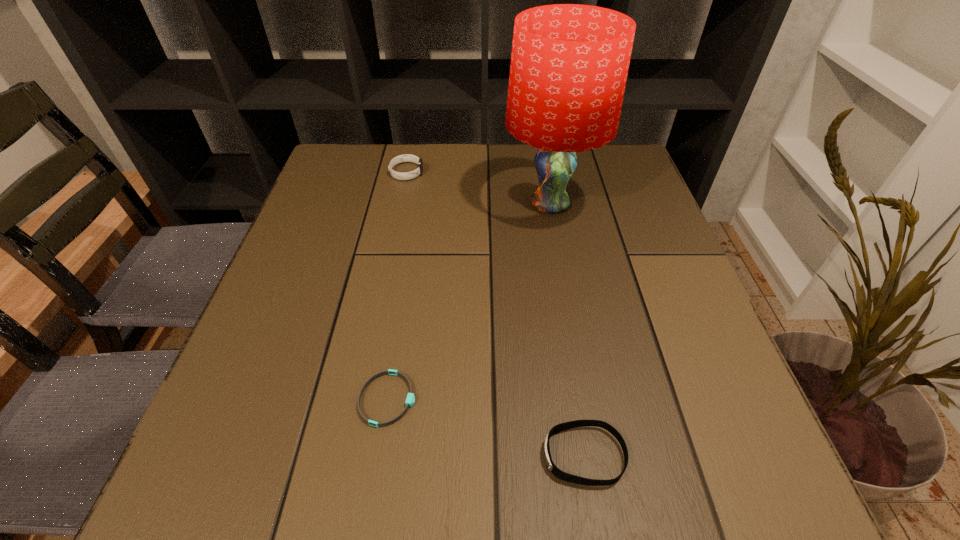
The image size is (960, 540). Identify the location of free space located on the display of the third tallest object. click(419, 456).

I want to click on free space located on the buckle of the shortest wristband, so click(x=542, y=399).

The height and width of the screenshot is (540, 960). Identify the location of lampshade present at the far edge. (569, 64).

Identify the location of wristband positioned at the far edge. (406, 157).

The width and height of the screenshot is (960, 540). Find the location of `object located in the near edge section of the desktop`. object located in the near edge section of the desktop is located at coordinates pos(564,476).

Identify the location of object that is positioned at the right edge. (569, 64).

The width and height of the screenshot is (960, 540). In order to click on object that is at the far right corner in this screenshot , I will do click(x=569, y=64).

Find the location of a particular element. The height and width of the screenshot is (540, 960). vacant area at the far edge is located at coordinates (434, 164).

Where is `free space at the near edge`? The width and height of the screenshot is (960, 540). free space at the near edge is located at coordinates (424, 477).

In the image, there is a desktop. At what (x,y) coordinates should I click in order to perform the action: click on vacant space at the left edge. Please return your answer as a coordinate pair (x, y). This screenshot has height=540, width=960. Looking at the image, I should click on (324, 210).